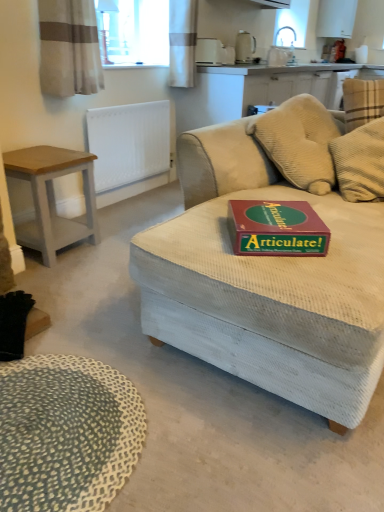
Question: From the image's perspective, would you say white textured curtain at upper center, which ranks as the 2th curtain in front-to-back order, is shown under matte beige kettle at upper center, positioned as the 1th appliance in top-to-bottom order?

Choices:
 (A) yes
 (B) no

Answer: (A)

Question: Is white textured curtain at upper center, arranged as the second curtain when viewed from the left, thinner than matte beige kettle at upper center, acting as the 2th appliance starting from the left?

Choices:
 (A) no
 (B) yes

Answer: (A)

Question: Is white textured curtain at upper center, the 1th curtain in the back-to-front sequence, wider than matte beige kettle at upper center, positioned as the 1th appliance in top-to-bottom order?

Choices:
 (A) yes
 (B) no

Answer: (A)

Question: Considering the relative positions of white textured curtain at upper center, which is counted as the 1th curtain, starting from the right, and matte beige kettle at upper center, positioned as the 1th appliance in top-to-bottom order, in the image provided, is white textured curtain at upper center, which is counted as the 1th curtain, starting from the right, to the right of matte beige kettle at upper center, positioned as the 1th appliance in top-to-bottom order, from the viewer's perspective?

Choices:
 (A) yes
 (B) no

Answer: (B)

Question: From a real-world perspective, is white textured curtain at upper center, arranged as the second curtain when viewed from the left, beneath matte beige kettle at upper center, which is the second appliance from front to back?

Choices:
 (A) yes
 (B) no

Answer: (A)

Question: Is light gray wood side table at left wider or thinner than white textured radiator at upper left?

Choices:
 (A) wide
 (B) thin

Answer: (A)

Question: From the image's perspective, relative to white textured radiator at upper left, is light gray wood side table at left above or below?

Choices:
 (A) above
 (B) below

Answer: (B)

Question: Considering the relative positions of light gray wood side table at left and white textured radiator at upper left in the image provided, is light gray wood side table at left to the left or to the right of white textured radiator at upper left?

Choices:
 (A) left
 (B) right

Answer: (A)

Question: Is light gray wood side table at left taller or shorter than white textured radiator at upper left?

Choices:
 (A) short
 (B) tall

Answer: (A)

Question: Is white textured radiator at upper left wider or thinner than light gray wood side table at left?

Choices:
 (A) thin
 (B) wide

Answer: (A)

Question: In terms of height, does white textured radiator at upper left look taller or shorter compared to light gray wood side table at left?

Choices:
 (A) tall
 (B) short

Answer: (A)

Question: In terms of size, does white textured radiator at upper left appear bigger or smaller than light gray wood side table at left?

Choices:
 (A) big
 (B) small

Answer: (B)

Question: Does point (152, 155) appear closer or farther from the camera than point (66, 170)?

Choices:
 (A) farther
 (B) closer

Answer: (A)

Question: Is white textured curtain at upper center, which ranks as the 2th curtain in front-to-back order, situated inside light gray wood side table at left or outside?

Choices:
 (A) inside
 (B) outside

Answer: (B)

Question: From the image's perspective, is white textured curtain at upper center, the 1th curtain in the back-to-front sequence, above or below light gray wood side table at left?

Choices:
 (A) above
 (B) below

Answer: (A)